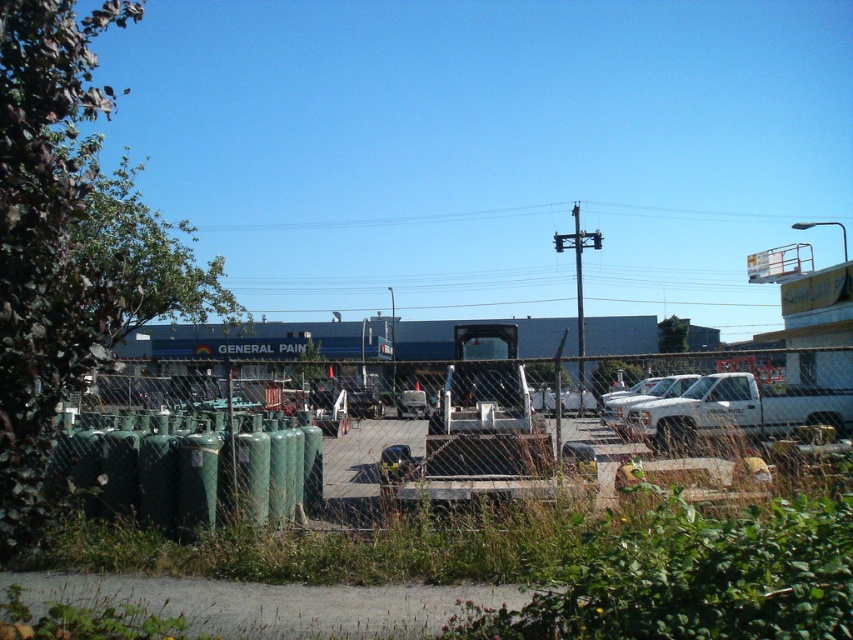
Consider the image. You are a delivery driver who needs to park your truck in the parking lot. You see the green matte cylinders at lower left and the white matte truck at right. Which object is bigger in size?

The green matte cylinders at lower left is larger in size than the white matte truck at right, so the green matte cylinders at lower left is bigger.

You are a delivery driver who needs to park your truck in a spot that is not occupied. The white matte truck at right is already parked. Based on the scene, where should you park your truck?

The white matte truck at right is located at point [735,412]. Since there are other vehicles parked in the lot, you should look for an empty spot away from the white matte truck at right, possibly near the flatbed trailer or another unoccupied area in the paved parking area.

You are standing at the center of the industrial area and want to locate the green matte cylinders at lower left. According to the coordinates provided, where should you look to find them?

The green matte cylinders at lower left are located at point (581,429).